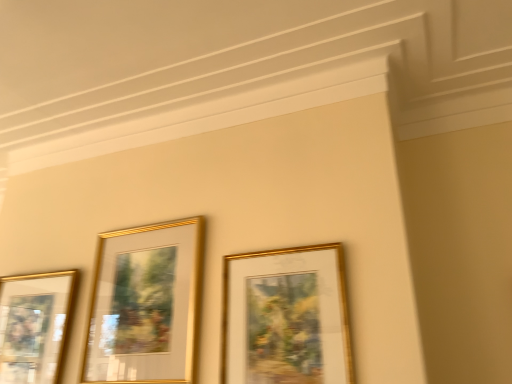
Question: Do you think gold/glossy picture frame at center, the first picture frame in the right-to-left sequence, is within gold metallic picture frame at left, which ranks as the 1th picture frame in left-to-right order, or outside of it?

Choices:
 (A) inside
 (B) outside

Answer: (B)

Question: Considering the positions of point (289, 273) and point (41, 296), is point (289, 273) closer or farther from the camera than point (41, 296)?

Choices:
 (A) farther
 (B) closer

Answer: (B)

Question: Which of these objects is positioned farthest from the gold metallic picture frame at left, which ranks as the 1th picture frame in left-to-right order?

Choices:
 (A) gold/glossy picture frame at center, which is the 2th picture frame from right to left
 (B) gold/glossy picture frame at center, acting as the third picture frame starting from the left

Answer: (B)

Question: Based on their relative distances, which object is nearer to the gold/glossy picture frame at center, acting as the third picture frame starting from the left?

Choices:
 (A) gold/glossy picture frame at center, the 2th picture frame viewed from the left
 (B) gold metallic picture frame at left, arranged as the third picture frame when viewed from the right

Answer: (A)